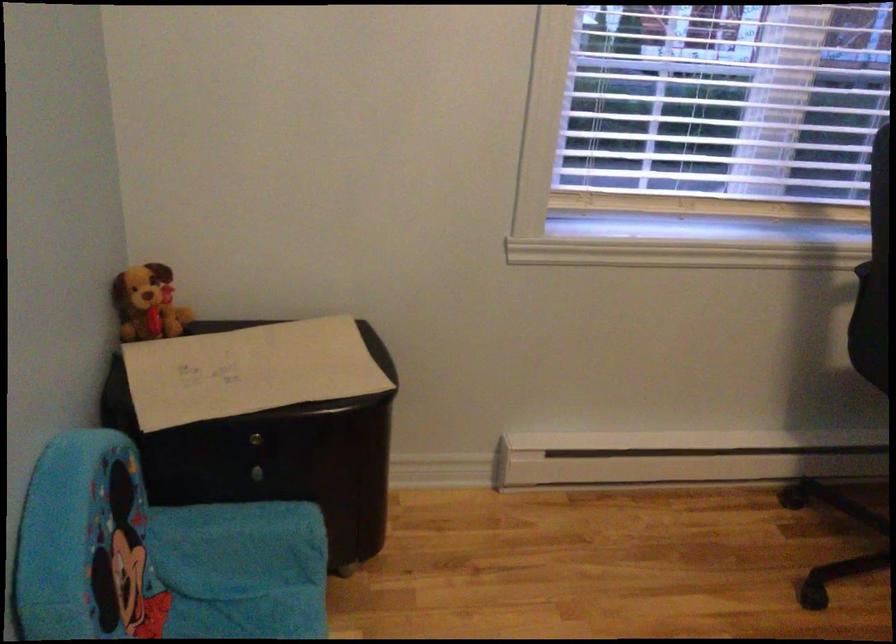
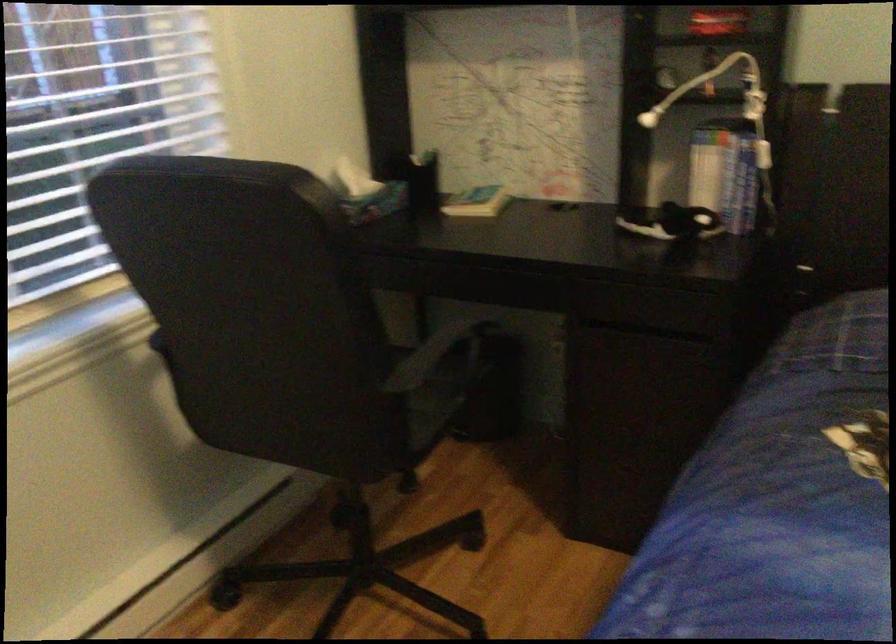
Question: Based on the continuous images, in which direction is the camera rotating? Reply with the corresponding letter.

Choices:
 (A) Left
 (B) Right
 (C) Up
 (D) Down

Answer: (B)